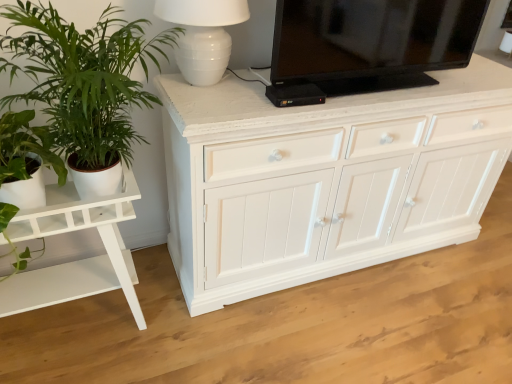
Find the location of a particular element. The width and height of the screenshot is (512, 384). white ceramic lamp at upper center is located at coordinates (203, 35).

Where is `white glossy table at left`? The width and height of the screenshot is (512, 384). white glossy table at left is located at coordinates (79, 260).

Describe the element at coordinates (79, 260) in the screenshot. I see `white glossy table at left` at that location.

At what (x,y) coordinates should I click in order to perform the action: click on green leafy plant at left. Please return your answer as a coordinate pair (x, y). The width and height of the screenshot is (512, 384). Looking at the image, I should click on (83, 79).

Which object is further away from the camera, green leafy plant at left or white glossy table at left?

white glossy table at left.

Can you confirm if green leafy plant at left is positioned to the left of white glossy table at left?

In fact, green leafy plant at left is to the right of white glossy table at left.

Could you tell me if green leafy plant at left is facing white glossy table at left?

No, green leafy plant at left is not facing towards white glossy table at left.

The image size is (512, 384). I want to click on table on the left of green leafy plant at left, so click(x=79, y=260).

Is black glossy television at upper center in front of or behind white ceramic lamp at upper center in the image?

Clearly, black glossy television at upper center is behind white ceramic lamp at upper center.

Locate an element on the screen. television above the white ceramic lamp at upper center (from a real-world perspective) is located at coordinates (367, 45).

From the image's perspective, which object appears higher, black glossy television at upper center or white ceramic lamp at upper center?

black glossy television at upper center appears higher in the image.

Does black glossy television at upper center have a lesser width compared to white ceramic lamp at upper center?

Indeed, black glossy television at upper center has a lesser width compared to white ceramic lamp at upper center.

Considering the sizes of white glossy table at left and green leafy plant at left in the image, is white glossy table at left taller or shorter than green leafy plant at left?

In the image, white glossy table at left appears to be taller than green leafy plant at left.

Does point (137, 189) come in front of point (45, 111)?

No, (137, 189) is behind (45, 111).

Measure the distance between white glossy table at left and green leafy plant at left.

white glossy table at left and green leafy plant at left are 33.64 centimeters apart.

In the scene shown: Is white glossy table at left looking in the opposite direction of green leafy plant at left?

white glossy table at left is not turned away from green leafy plant at left.

From the image's perspective, does white glossy table at left appear higher than black glossy television at upper center?

No.

Does white glossy table at left have a greater width compared to black glossy television at upper center?

Correct, the width of white glossy table at left exceeds that of black glossy television at upper center.

In terms of size, does white glossy table at left appear bigger or smaller than black glossy television at upper center?

Considering their sizes, white glossy table at left takes up more space than black glossy television at upper center.

From a real-world perspective, which is physically above, white glossy table at left or black glossy television at upper center?

From a 3D spatial view, black glossy television at upper center is above.

Which is correct: green leafy plant at left is inside white ceramic lamp at upper center, or outside of it?

green leafy plant at left cannot be found inside white ceramic lamp at upper center.

Can you confirm if green leafy plant at left is bigger than white ceramic lamp at upper center?

Correct, green leafy plant at left is larger in size than white ceramic lamp at upper center.

Find the location of a particular element. Image resolution: width=512 pixels, height=384 pixels. table lamp on the right of green leafy plant at left is located at coordinates (203, 35).

Considering the positions of objects green leafy plant at left and white ceramic lamp at upper center in the image provided, who is in front, green leafy plant at left or white ceramic lamp at upper center?

green leafy plant at left.

Which of these two, white glossy table at left or white ceramic lamp at upper center, stands shorter?

With less height is white ceramic lamp at upper center.

Between white glossy table at left and white ceramic lamp at upper center, which one has larger size?

white glossy table at left.

Based on the photo, is white glossy table at left facing away from white ceramic lamp at upper center?

No, white glossy table at left is not facing the opposite direction of white ceramic lamp at upper center.

You are a GUI agent. You are given a task and a screenshot of the screen. Output one action in this format:
    pyautogui.click(x=<x>, y=<y>)
    Task: Click on the table below the black glossy television at upper center (from a real-world perspective)
    Image resolution: width=512 pixels, height=384 pixels.
    Given the screenshot: What is the action you would take?
    pyautogui.click(x=79, y=260)

From the picture: Does black glossy television at upper center turn towards white glossy table at left?

No.

In the scene shown: Considering the relative sizes of black glossy television at upper center and white glossy table at left in the image provided, is black glossy television at upper center taller than white glossy table at left?

In fact, black glossy television at upper center may be shorter than white glossy table at left.

Is black glossy television at upper center touching white glossy table at left?

No, black glossy television at upper center is not with white glossy table at left.

Where is `houseplant to the right of white glossy table at left`? houseplant to the right of white glossy table at left is located at coordinates (83, 79).

Find the location of `table lamp that appears in front of the black glossy television at upper center`. table lamp that appears in front of the black glossy television at upper center is located at coordinates (203, 35).

Looking at the image, which one is located closer to green leafy plant at left, white glossy table at left or white ceramic lamp at upper center?

white ceramic lamp at upper center is closer to green leafy plant at left.

When comparing their distances from white glossy table at left, does green leafy plant at left or white ceramic lamp at upper center seem closer?

green leafy plant at left lies closer to white glossy table at left than the other object.

Estimate the real-world distances between objects in this image. Which object is closer to white ceramic lamp at upper center, white glossy table at left or green leafy plant at left?

Among the two, green leafy plant at left is located nearer to white ceramic lamp at upper center.

Consider the image. Based on their spatial positions, is white glossy table at left or white ceramic lamp at upper center closer to black glossy television at upper center?

Among the two, white ceramic lamp at upper center is located nearer to black glossy television at upper center.

Looking at the image, which one is located further to white glossy table at left, black glossy television at upper center or white ceramic lamp at upper center?

Among the two, black glossy television at upper center is located further to white glossy table at left.

Considering their positions, is white ceramic lamp at upper center positioned further to white glossy table at left than green leafy plant at left?

white ceramic lamp at upper center.

When comparing their distances from green leafy plant at left, does black glossy television at upper center or white glossy table at left seem further?

Among the two, black glossy television at upper center is located further to green leafy plant at left.

Which object lies nearer to the anchor point white ceramic lamp at upper center, green leafy plant at left or black glossy television at upper center?

green leafy plant at left lies closer to white ceramic lamp at upper center than the other object.

Identify the location of houseplant between white glossy table at left and black glossy television at upper center from left to right. The height and width of the screenshot is (384, 512). (83, 79).

At what (x,y) coordinates should I click in order to perform the action: click on table lamp between white glossy table at left and black glossy television at upper center. Please return your answer as a coordinate pair (x, y). Looking at the image, I should click on (203, 35).

Locate an element on the screen. Image resolution: width=512 pixels, height=384 pixels. table lamp between green leafy plant at left and black glossy television at upper center is located at coordinates (203, 35).

I want to click on houseplant that lies between white ceramic lamp at upper center and white glossy table at left from top to bottom, so click(x=83, y=79).